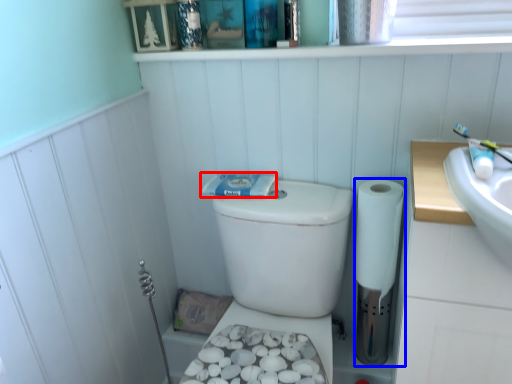
Question: Which object is closer to the camera taking this photo, toothpaste (highlighted by a red box) or toilet paper (highlighted by a blue box)?

Choices:
 (A) toothpaste
 (B) toilet paper

Answer: (B)